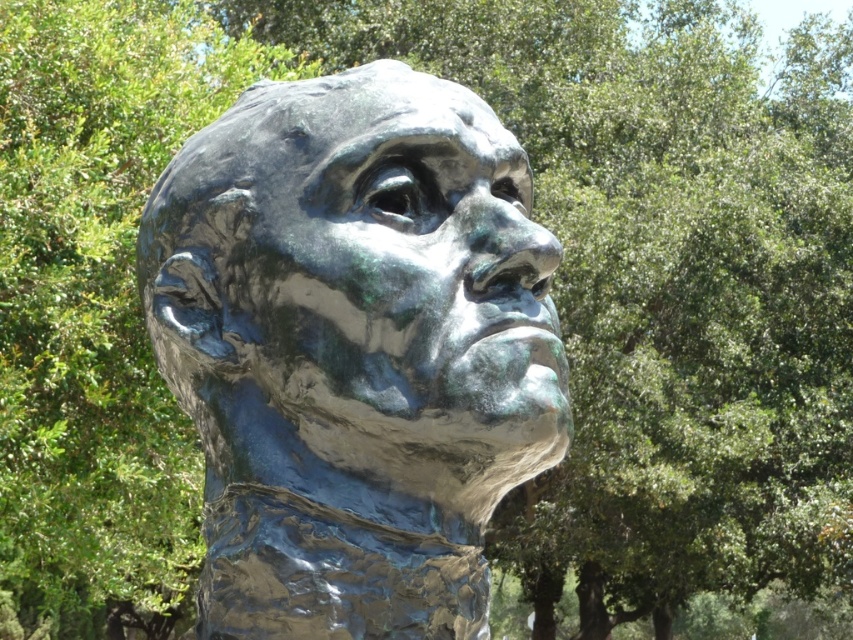
Question: Does green patina bronze head at center have a smaller size compared to green patina sculpture at center?

Choices:
 (A) no
 (B) yes

Answer: (A)

Question: Which object appears farthest from the camera in this image?

Choices:
 (A) green patina sculpture at center
 (B) green patina bronze head at center

Answer: (B)

Question: Which point appears farthest from the camera in this image?

Choices:
 (A) (566, 392)
 (B) (292, 116)

Answer: (B)

Question: Can you confirm if green patina bronze head at center is bigger than green patina sculpture at center?

Choices:
 (A) yes
 (B) no

Answer: (A)

Question: Can you confirm if green patina bronze head at center is positioned to the right of green patina sculpture at center?

Choices:
 (A) yes
 (B) no

Answer: (B)

Question: Which object appears closest to the camera in this image?

Choices:
 (A) green patina sculpture at center
 (B) green patina bronze head at center

Answer: (A)